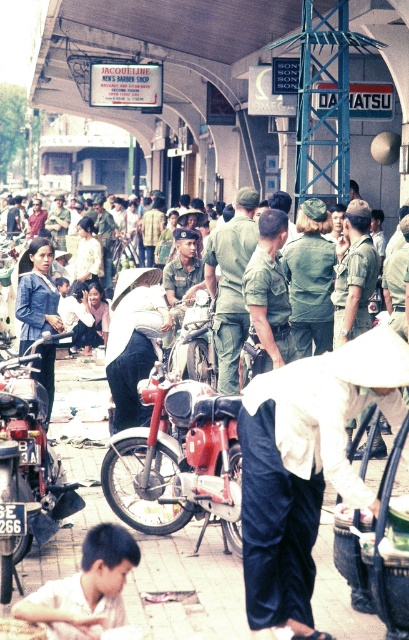
You are a pedestrian standing on the pavement in the scene. You need to walk from the shiny chrome motorcycle at lower left to the green matte uniform at center. Which direction should you move?

You should move to the right because the shiny chrome motorcycle at lower left is to the left of the green matte uniform at center, so moving right will take you towards it.

In the scene shown: You are a photographer standing in the street scene. You want to take a photo of the white cotton hat at center and the shiny chrome motorcycle at lower left. Which object should you focus on first if you want to capture both in the frame without moving the camera?

The white cotton hat at center is taller than the shiny chrome motorcycle at lower left, so you should focus on the white cotton hat at center first to ensure it fits within the frame.

You are standing at the point closer to the ground in the scene. There are two points marked in the image, one at coordinates point (303, 445) and the other at point (35, 444). Which point is farther away from you?

Point (303, 445) is in front of point (35, 444), so if you are standing at the point closer to the ground, which is point (35, 444), then the point farther away from you would be point (303, 445).